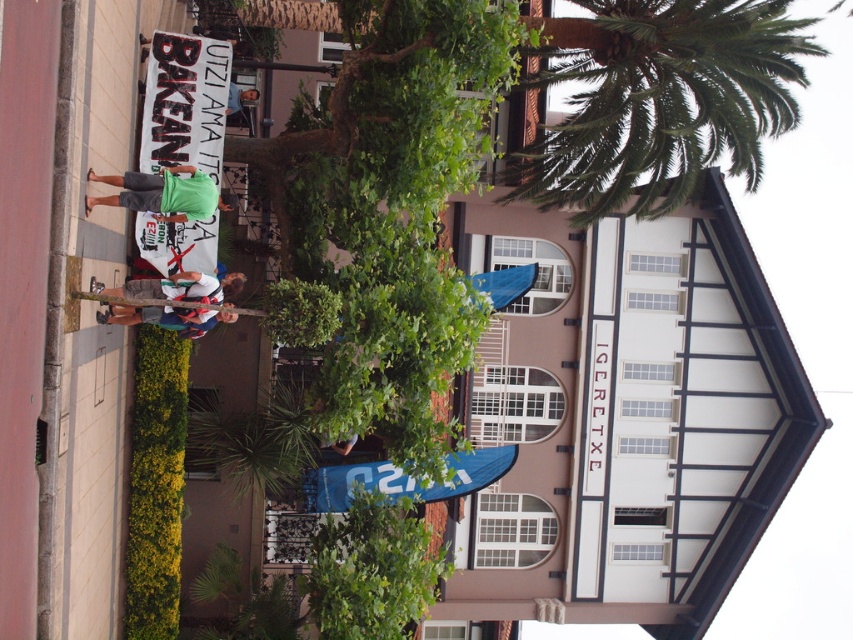
Question: Where is green leafy palm tree at upper right located in relation to green fabric shirt at center in the image?

Choices:
 (A) below
 (B) above

Answer: (B)

Question: Among these objects, which one is nearest to the camera?

Choices:
 (A) white cotton shirt at center
 (B) green leafy palm tree at upper right

Answer: (A)

Question: Among these objects, which one is farthest from the camera?

Choices:
 (A) green fabric sign at upper center
 (B) white cotton shirt at center
 (C) green fabric shirt at center
 (D) green leafy palm tree at upper right

Answer: (D)

Question: Does white cotton shirt at center have a larger size compared to green fabric sign at upper center?

Choices:
 (A) yes
 (B) no

Answer: (B)

Question: Does green leafy palm tree at upper right appear under green fabric shirt at center?

Choices:
 (A) no
 (B) yes

Answer: (A)

Question: Which of the following is the closest to the observer?

Choices:
 (A) (167, 182)
 (B) (144, 280)
 (C) (627, 182)

Answer: (A)